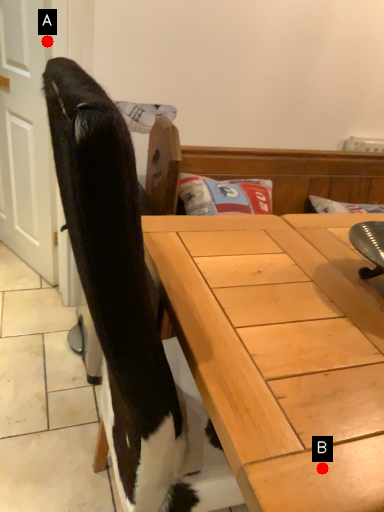
Question: Two points are circled on the image, labeled by A and B beside each circle. Which point appears farthest from the camera in this image?

Choices:
 (A) A is further
 (B) B is further

Answer: (A)